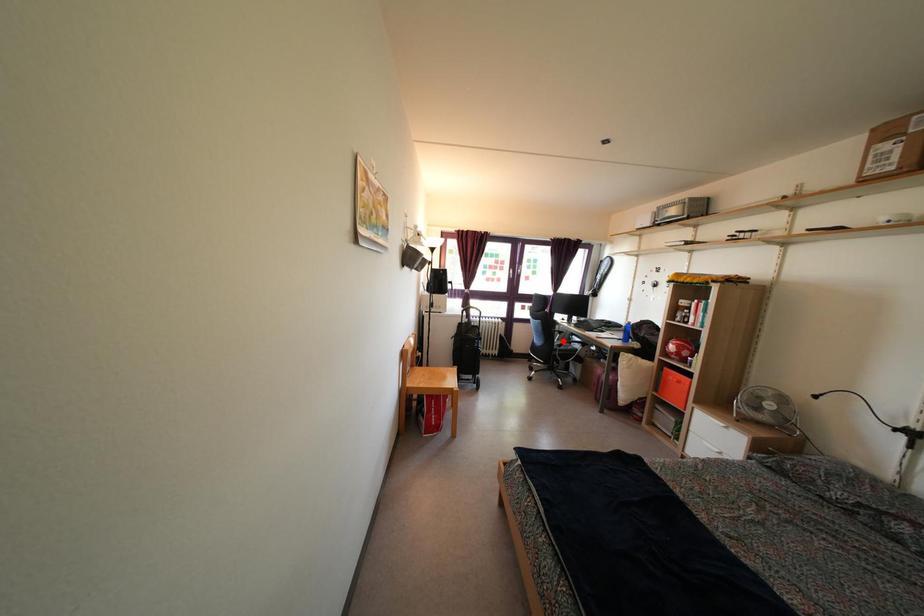
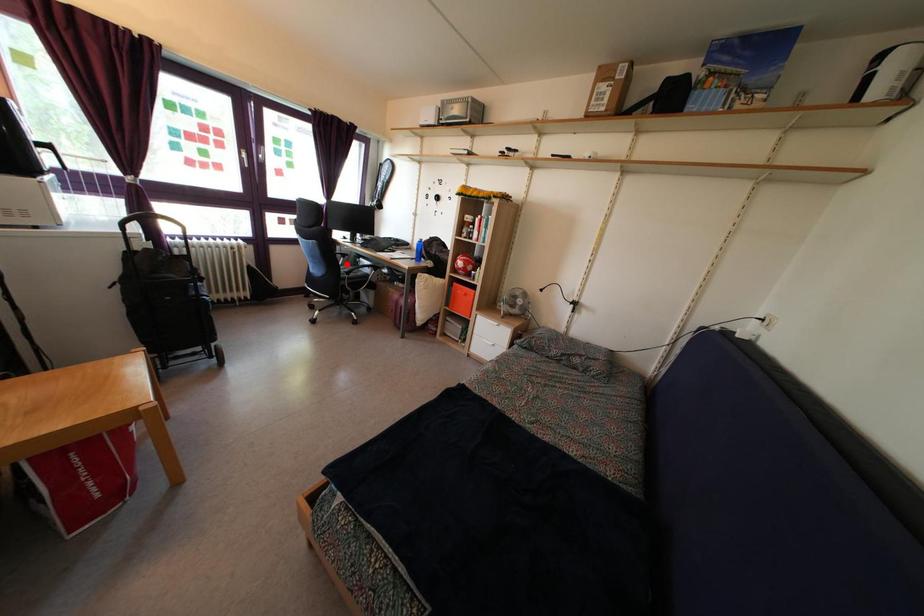
I am providing you with two images of the same scene from different viewpoints. A red point is marked on the first image and another point is marked on the second image. Is the marked point in image1 the same physical position as the marked point in image2?

Yes